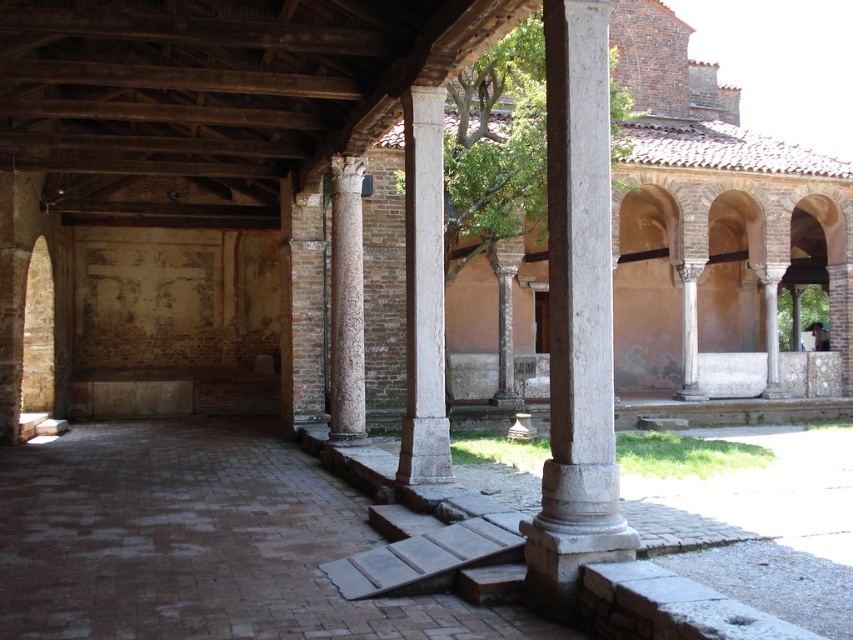
You are an architect examining the courtyard. You notice the white stone column at center and the brown textured column at center. Which column has a smaller diameter?

The white stone column at center has a smaller diameter than the brown textured column at center.

You are standing in the courtyard and want to move from the brown textured column at center to the white stone column at center. In which direction should you walk?

You should walk to the right to reach the white stone column at center from the brown textured column at center since it is positioned to the right of it.